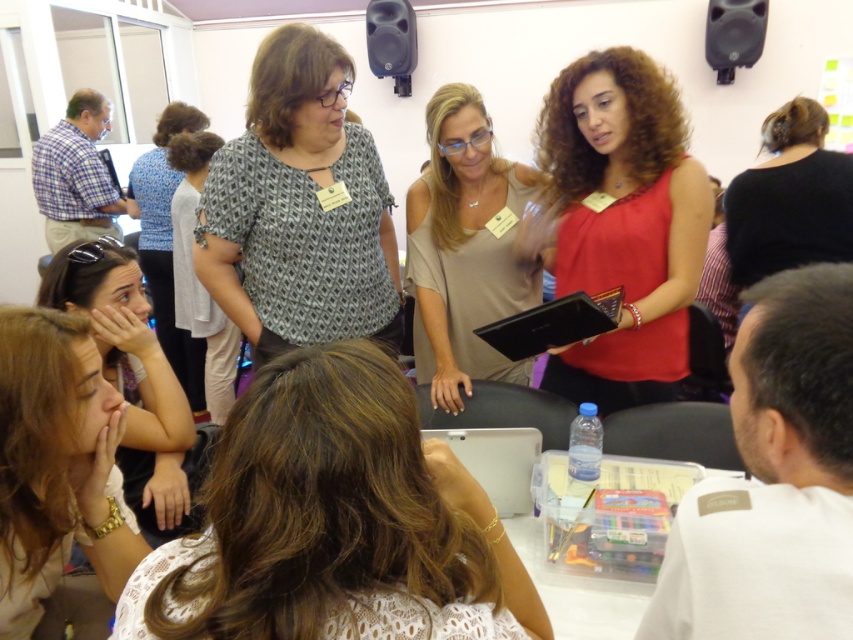
You are a photographer trying to capture a photo of the two leaders in the conference room. You need to position yourself so that you can see both the patterned fabric blouse at center and the black matte hair at upper right in the frame. Based on their positions, which direction should you stand relative to the seated participants?

You should position yourself to the right of the seated participants so that both the patterned fabric blouse at center and the black matte hair at upper right are visible in the frame. Since the patterned fabric blouse at center is to the left of the black matte hair at upper right, standing to the right allows you to capture both in the same view.

You are a photographer in the room and want to take a photo of both the patterned fabric blouse at center and the black matte hair at upper right. However, you can only focus on one object at a time. Which object should you focus on to ensure the other is still visible in the background?

The patterned fabric blouse at center is in front of the black matte hair at upper right. To ensure the black matte hair at upper right is visible in the background, focus on the patterned fabric blouse at center. This way, the black matte hair at upper right will be behind it and still in view.